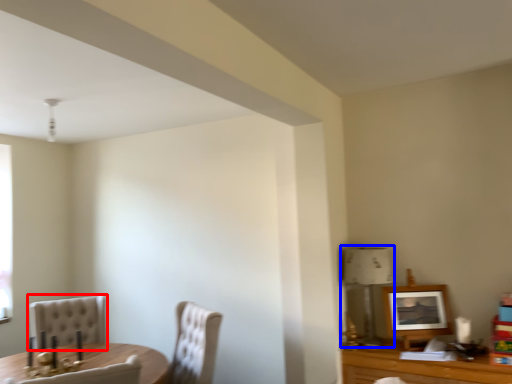
Question: Which object is closer to the camera taking this photo, chair (highlighted by a red box) or lamp (highlighted by a blue box)?

Choices:
 (A) chair
 (B) lamp

Answer: (B)